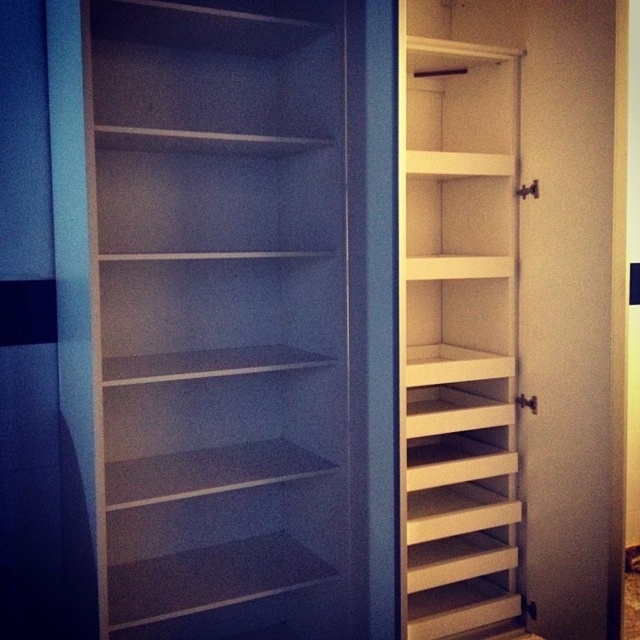
What do you see at coordinates (225, 314) in the screenshot? I see `white matte bookshelf at left` at bounding box center [225, 314].

Is white matte bookshelf at left positioned in front of white wood bookshelf at right?

Yes, white matte bookshelf at left is closer to the viewer.

The image size is (640, 640). I want to click on white matte bookshelf at left, so click(x=225, y=314).